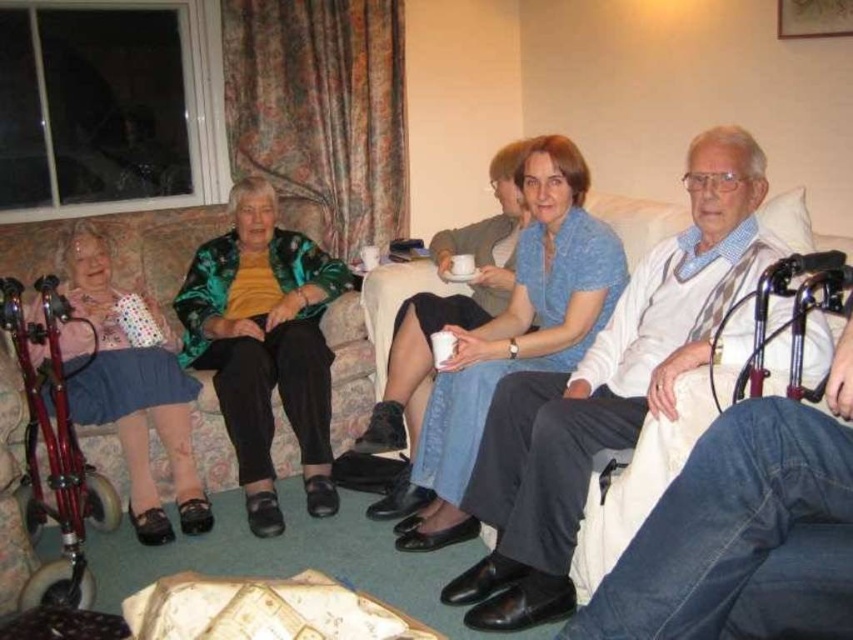
Question: In this image, where is velvet fabric couch at left located relative to polka dot fabric dress at left?

Choices:
 (A) below
 (B) above

Answer: (A)

Question: Can you confirm if velvet fabric couch at left is smaller than polka dot fabric dress at left?

Choices:
 (A) no
 (B) yes

Answer: (A)

Question: Considering the relative positions of velvet fabric couch at left and polka dot fabric dress at left in the image provided, where is velvet fabric couch at left located with respect to polka dot fabric dress at left?

Choices:
 (A) right
 (B) left

Answer: (A)

Question: Which object is farther from the camera taking this photo?

Choices:
 (A) blue cotton shirt at center
 (B) velvet fabric couch at left

Answer: (A)

Question: Which point is closer to the camera?

Choices:
 (A) green metallic jacket at center
 (B) velvet fabric couch at left
 (C) polka dot fabric dress at left

Answer: (B)

Question: Which of the following is the farthest from the observer?

Choices:
 (A) polka dot fabric dress at left
 (B) blue cotton shirt at center
 (C) velvet fabric couch at left

Answer: (A)